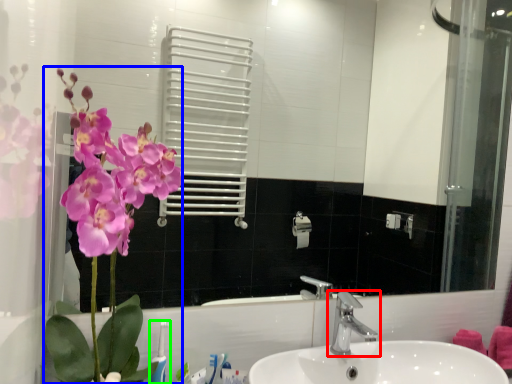
Question: Which object is the farthest from tap (highlighted by a red box)? Choose among these: floral arrangement (highlighted by a blue box) or toothbrush (highlighted by a green box).

Choices:
 (A) floral arrangement
 (B) toothbrush

Answer: (A)